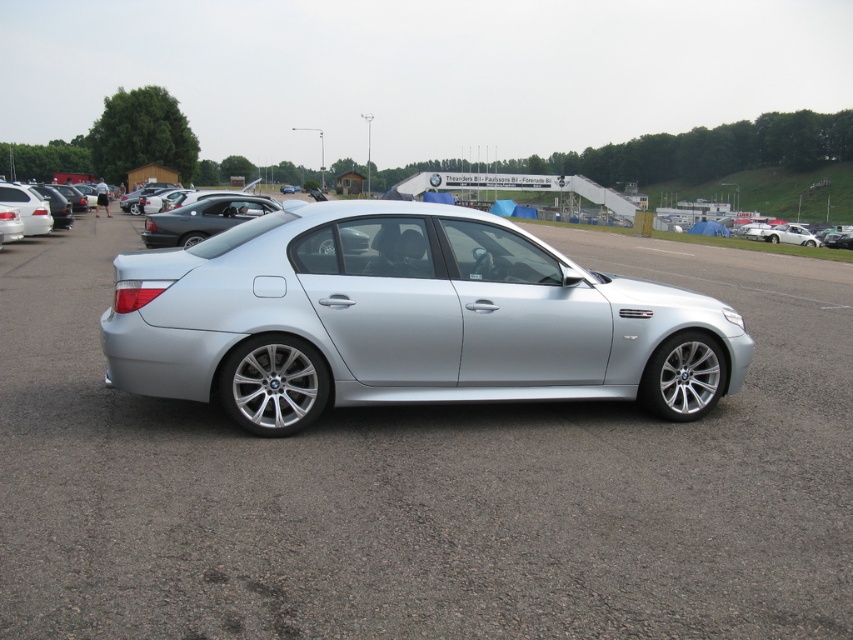
Which is above, silver metallic car at center or satin silver car at center?

silver metallic car at center is higher up.

Between silver metallic car at center and satin silver car at center, which one is positioned lower?

satin silver car at center is below.

Measure the distance between silver metallic car at center and camera.

silver metallic car at center is 2.78 meters away from camera.

Identify the location of silver metallic car at center. The width and height of the screenshot is (853, 640). (428, 484).

Can you confirm if satin silver car at center is bigger than silver metallic sedan at left?

Correct, satin silver car at center is larger in size than silver metallic sedan at left.

Can you confirm if satin silver car at center is wider than silver metallic sedan at left?

Yes, satin silver car at center is wider than silver metallic sedan at left.

At what (x,y) coordinates should I click in order to perform the action: click on satin silver car at center. Please return your answer as a coordinate pair (x, y). Looking at the image, I should click on (404, 320).

This screenshot has height=640, width=853. What are the coordinates of `satin silver car at center` in the screenshot? It's located at (404, 320).

Can you confirm if silver metallic car at center is smaller than silver metallic sedan at left?

Actually, silver metallic car at center might be larger than silver metallic sedan at left.

Locate an element on the screen. silver metallic car at center is located at coordinates (428, 484).

Identify the location of silver metallic car at center. (428, 484).